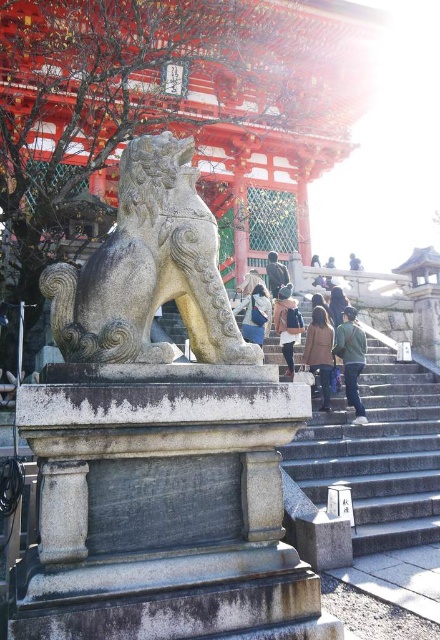
Describe the element at coordinates (377, 454) in the screenshot. This screenshot has width=440, height=640. I see `gray stone stairs at center` at that location.

Is gray stone stairs at center to the right of blue denim jeans at center from the viewer's perspective?

Indeed, gray stone stairs at center is positioned on the right side of blue denim jeans at center.

Image resolution: width=440 pixels, height=640 pixels. Identify the location of gray stone stairs at center. (377, 454).

Locate an element on the screen. This screenshot has width=440, height=640. gray stone stairs at center is located at coordinates (377, 454).

What do you see at coordinates (286, 323) in the screenshot?
I see `dark brown leather backpack at center` at bounding box center [286, 323].

Identify the location of dark brown leather backpack at center. Image resolution: width=440 pixels, height=640 pixels. (286, 323).

Is point (336, 340) behind point (241, 307)?

No, (336, 340) is in front of (241, 307).

Locate an element on the screen. Image resolution: width=440 pixels, height=640 pixels. green fabric jacket at center is located at coordinates (352, 358).

Locate an element on the screen. The image size is (440, 640). green fabric jacket at center is located at coordinates (352, 358).